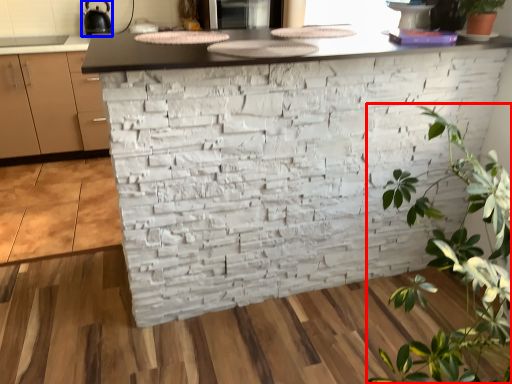
Question: Which object appears closest to the camera in this image, houseplant (highlighted by a red box) or appliance (highlighted by a blue box)?

Choices:
 (A) houseplant
 (B) appliance

Answer: (A)